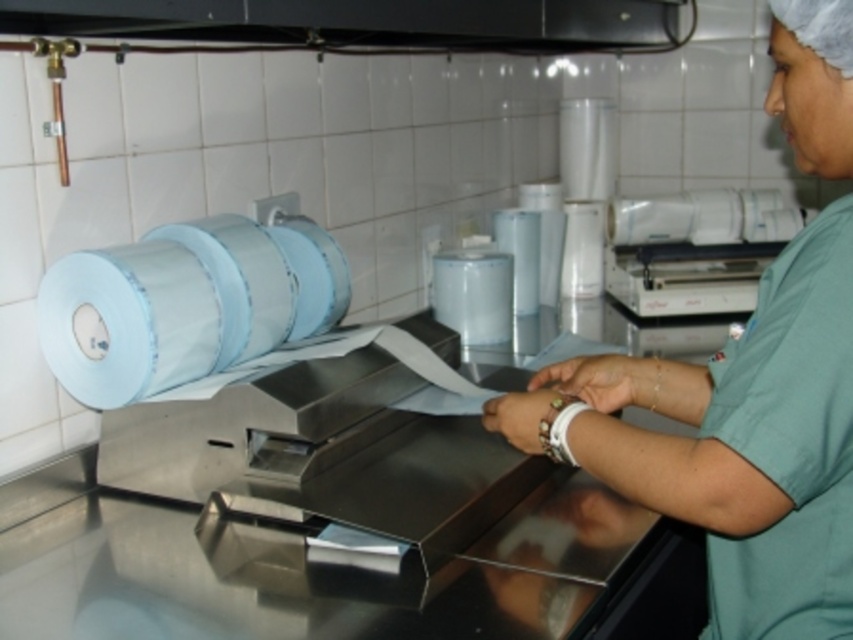
You are a chef preparing to use the blue glossy toilet paper at left and the white glossy toilet paper at upper right. Which one is taller?

The blue glossy toilet paper at left is much taller than the white glossy toilet paper at upper right.

You are a chef preparing to place a small bowl on the metallic stainless steel counter top at center and the white glossy toilet paper at upper right. Which surface can accommodate the bowl without it being too unstable?

The metallic stainless steel counter top at center is much taller than the white glossy toilet paper at upper right, so placing the bowl on the counter top would provide a more stable surface.

You are a chef preparing ingredients in the kitchen. You need to place a cutting board on the metallic stainless steel counter top at center and the white glossy toilet paper at upper right. Which surface is more to the left?

The metallic stainless steel counter top at center is positioned on the left side of white glossy toilet paper at upper right, so it is more to the left.